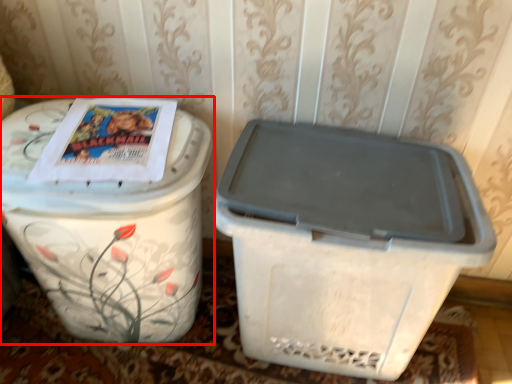
Question: From the image's perspective, what is the correct spatial positioning of waste container (annotated by the red box) in reference to waste container?

Choices:
 (A) above
 (B) below

Answer: (A)